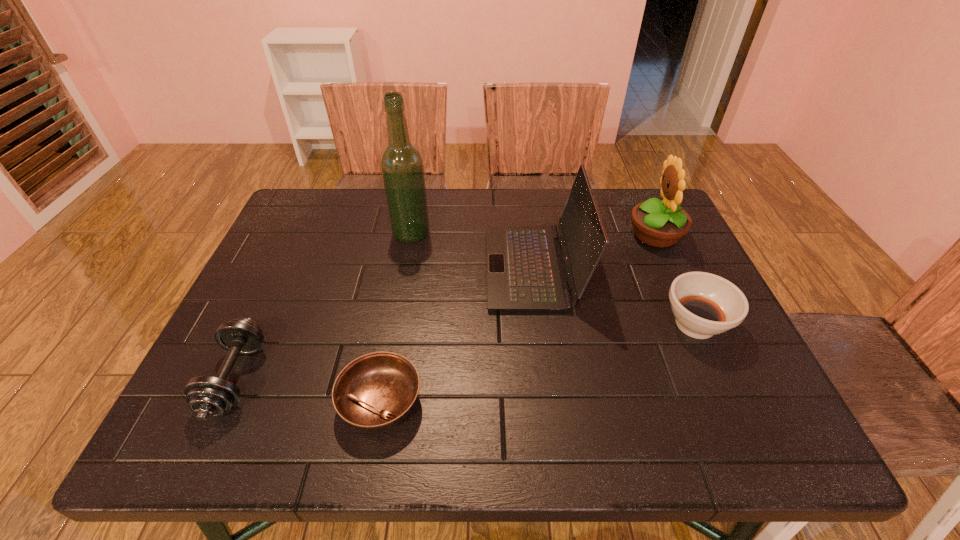
The image size is (960, 540). I want to click on free space located on the face of the sunflower, so click(x=553, y=235).

Find the location of a particular element. free space located on the face of the sunflower is located at coordinates (564, 235).

At what (x,y) coordinates should I click in order to perform the action: click on free space located on the screen of the fourth object from left to right. Please return your answer as a coordinate pair (x, y). This screenshot has height=540, width=960. Looking at the image, I should click on (464, 267).

Identify the location of blank area located on the screen of the fourth object from left to right. Image resolution: width=960 pixels, height=540 pixels. (337, 267).

At what (x,y) coordinates should I click in order to perform the action: click on free location located 0.190m on the screen of the fourth object from left to right. Please return your answer as a coordinate pair (x, y). Looking at the image, I should click on (414, 267).

You are a GUI agent. You are given a task and a screenshot of the screen. Output one action in this format:
    pyautogui.click(x=<x>, y=<y>)
    Task: Click on the vacant space located on the back of the leftmost object
    Image resolution: width=960 pixels, height=540 pixels.
    Given the screenshot: What is the action you would take?
    pyautogui.click(x=305, y=230)

Identify the location of free space located 0.360m on the left of the farther soup bowl. This screenshot has width=960, height=540. coord(504,325).

Identify the location of free location located 0.330m on the right of the left soup bowl. pos(589,402).

The height and width of the screenshot is (540, 960). What are the coordinates of `liquor present at the far edge` in the screenshot? It's located at (402, 168).

Find the location of a particular element. Image resolution: width=960 pixels, height=540 pixels. sunflower located in the far edge section of the desktop is located at coordinates (659, 224).